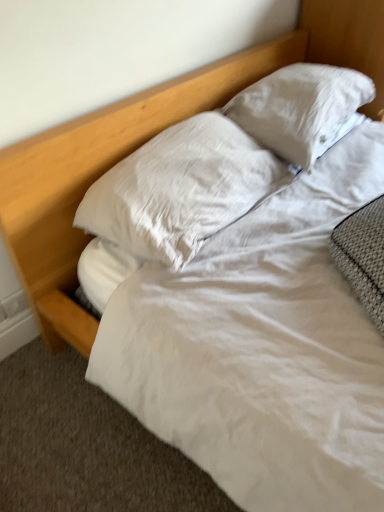
The image size is (384, 512). What do you see at coordinates (181, 189) in the screenshot?
I see `white soft pillow at center, the 2th pillow viewed from the right` at bounding box center [181, 189].

Where is `white soft pillow at center, the 1th pillow in the left-to-right sequence`? Image resolution: width=384 pixels, height=512 pixels. white soft pillow at center, the 1th pillow in the left-to-right sequence is located at coordinates (181, 189).

Identify the location of white satin pillow at upper center, which is counted as the 2th pillow, starting from the left. The image size is (384, 512). (300, 109).

What do you see at coordinates (300, 109) in the screenshot? I see `white satin pillow at upper center, which is counted as the 2th pillow, starting from the left` at bounding box center [300, 109].

The image size is (384, 512). I want to click on white soft pillow at center, the 1th pillow in the left-to-right sequence, so click(181, 189).

Based on their positions, is white satin pillow at upper center, marked as the first pillow in a right-to-left arrangement, located to the left or right of white soft pillow at center, the 1th pillow in the left-to-right sequence?

Clearly, white satin pillow at upper center, marked as the first pillow in a right-to-left arrangement, is on the right of white soft pillow at center, the 1th pillow in the left-to-right sequence, in the image.

Relative to white soft pillow at center, the 1th pillow in the left-to-right sequence, is white satin pillow at upper center, which is counted as the 2th pillow, starting from the left, in front or behind?

Visually, white satin pillow at upper center, which is counted as the 2th pillow, starting from the left, is located behind white soft pillow at center, the 1th pillow in the left-to-right sequence.

Does point (307, 64) appear closer or farther from the camera than point (166, 230)?

Point (307, 64).

From the image's perspective, is white satin pillow at upper center, which is counted as the 2th pillow, starting from the left, located beneath white soft pillow at center, the 2th pillow viewed from the right?

Actually, white satin pillow at upper center, which is counted as the 2th pillow, starting from the left, appears above white soft pillow at center, the 2th pillow viewed from the right, in the image.

From a real-world perspective, is white satin pillow at upper center, which is counted as the 2th pillow, starting from the left, above or below white soft pillow at center, the 2th pillow viewed from the right?

white satin pillow at upper center, which is counted as the 2th pillow, starting from the left, is situated higher than white soft pillow at center, the 2th pillow viewed from the right, in the real world.

Which object is thinner, white satin pillow at upper center, which is counted as the 2th pillow, starting from the left, or white soft pillow at center, the 2th pillow viewed from the right?

white satin pillow at upper center, which is counted as the 2th pillow, starting from the left, is thinner.

Considering the relative sizes of white satin pillow at upper center, marked as the first pillow in a right-to-left arrangement, and white soft pillow at center, the 1th pillow in the left-to-right sequence, in the image provided, is white satin pillow at upper center, marked as the first pillow in a right-to-left arrangement, shorter than white soft pillow at center, the 1th pillow in the left-to-right sequence,?

In fact, white satin pillow at upper center, marked as the first pillow in a right-to-left arrangement, may be taller than white soft pillow at center, the 1th pillow in the left-to-right sequence.

Between white satin pillow at upper center, which is counted as the 2th pillow, starting from the left, and white soft pillow at center, the 2th pillow viewed from the right, which one has smaller size?

Smaller between the two is white soft pillow at center, the 2th pillow viewed from the right.

Is white soft pillow at center, the 2th pillow viewed from the right, located within white satin pillow at upper center, which is counted as the 2th pillow, starting from the left?

No, white soft pillow at center, the 2th pillow viewed from the right, is not inside white satin pillow at upper center, which is counted as the 2th pillow, starting from the left.

Could you tell me if white satin pillow at upper center, which is counted as the 2th pillow, starting from the left, is facing white soft pillow at center, the 2th pillow viewed from the right?

No, white satin pillow at upper center, which is counted as the 2th pillow, starting from the left, is not turned towards white soft pillow at center, the 2th pillow viewed from the right.

What's the angular difference between white satin pillow at upper center, which is counted as the 2th pillow, starting from the left, and white soft pillow at center, the 2th pillow viewed from the right,'s facing directions?

0.000446 degrees.

This screenshot has width=384, height=512. Identify the location of pillow below the white satin pillow at upper center, marked as the first pillow in a right-to-left arrangement (from the image's perspective). (181, 189).

Between white soft pillow at center, the 2th pillow viewed from the right, and white satin pillow at upper center, marked as the first pillow in a right-to-left arrangement, which one appears on the left side from the viewer's perspective?

Positioned to the left is white soft pillow at center, the 2th pillow viewed from the right.

Is white soft pillow at center, the 1th pillow in the left-to-right sequence, positioned before white satin pillow at upper center, which is counted as the 2th pillow, starting from the left?

Yes, white soft pillow at center, the 1th pillow in the left-to-right sequence, is closer to the camera.

Which is in front, point (187, 218) or point (302, 148)?

The point (187, 218) is closer.

From the image's perspective, which one is positioned lower, white soft pillow at center, the 1th pillow in the left-to-right sequence, or white satin pillow at upper center, which is counted as the 2th pillow, starting from the left?

white soft pillow at center, the 1th pillow in the left-to-right sequence, from the image's perspective.

From a real-world perspective, who is located lower, white soft pillow at center, the 2th pillow viewed from the right, or white satin pillow at upper center, marked as the first pillow in a right-to-left arrangement?

white soft pillow at center, the 2th pillow viewed from the right, from a real-world perspective.

Does white soft pillow at center, the 2th pillow viewed from the right, have a lesser width compared to white satin pillow at upper center, marked as the first pillow in a right-to-left arrangement?

No, white soft pillow at center, the 2th pillow viewed from the right, is not thinner than white satin pillow at upper center, marked as the first pillow in a right-to-left arrangement.

Who is taller, white soft pillow at center, the 2th pillow viewed from the right, or white satin pillow at upper center, marked as the first pillow in a right-to-left arrangement?

Standing taller between the two is white satin pillow at upper center, marked as the first pillow in a right-to-left arrangement.

Who is bigger, white soft pillow at center, the 2th pillow viewed from the right, or white satin pillow at upper center, marked as the first pillow in a right-to-left arrangement?

Bigger between the two is white satin pillow at upper center, marked as the first pillow in a right-to-left arrangement.

Is white soft pillow at center, the 1th pillow in the left-to-right sequence, situated inside white satin pillow at upper center, marked as the first pillow in a right-to-left arrangement, or outside?

white soft pillow at center, the 1th pillow in the left-to-right sequence, cannot be found inside white satin pillow at upper center, marked as the first pillow in a right-to-left arrangement.

In the scene shown: Are white soft pillow at center, the 2th pillow viewed from the right, and white satin pillow at upper center, marked as the first pillow in a right-to-left arrangement, located far from each other?

No, white soft pillow at center, the 2th pillow viewed from the right, is in close proximity to white satin pillow at upper center, marked as the first pillow in a right-to-left arrangement.

Is white soft pillow at center, the 1th pillow in the left-to-right sequence, facing towards white satin pillow at upper center, marked as the first pillow in a right-to-left arrangement?

No, white soft pillow at center, the 1th pillow in the left-to-right sequence, is not turned towards white satin pillow at upper center, marked as the first pillow in a right-to-left arrangement.

How much distance is there between white soft pillow at center, the 2th pillow viewed from the right, and white satin pillow at upper center, marked as the first pillow in a right-to-left arrangement?

32.64 centimeters.

Where is `pillow in front of the white satin pillow at upper center, which is counted as the 2th pillow, starting from the left`? The height and width of the screenshot is (512, 384). pillow in front of the white satin pillow at upper center, which is counted as the 2th pillow, starting from the left is located at coordinates (181, 189).

At what (x,y) coordinates should I click in order to perform the action: click on pillow above the white soft pillow at center, the 1th pillow in the left-to-right sequence (from the image's perspective). Please return your answer as a coordinate pair (x, y). The width and height of the screenshot is (384, 512). Looking at the image, I should click on (300, 109).

The width and height of the screenshot is (384, 512). I want to click on pillow positioned vertically above the white soft pillow at center, the 1th pillow in the left-to-right sequence (from a real-world perspective), so click(x=300, y=109).